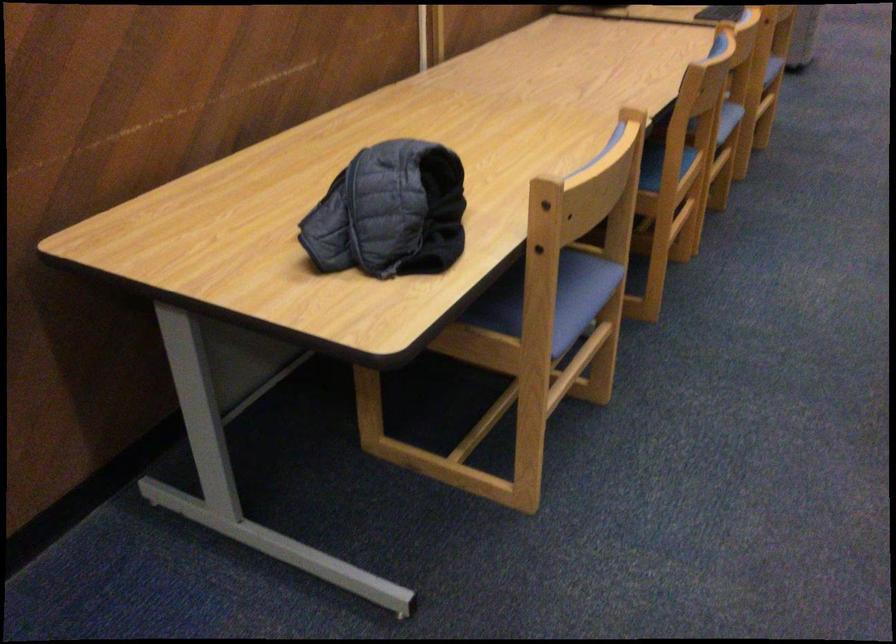
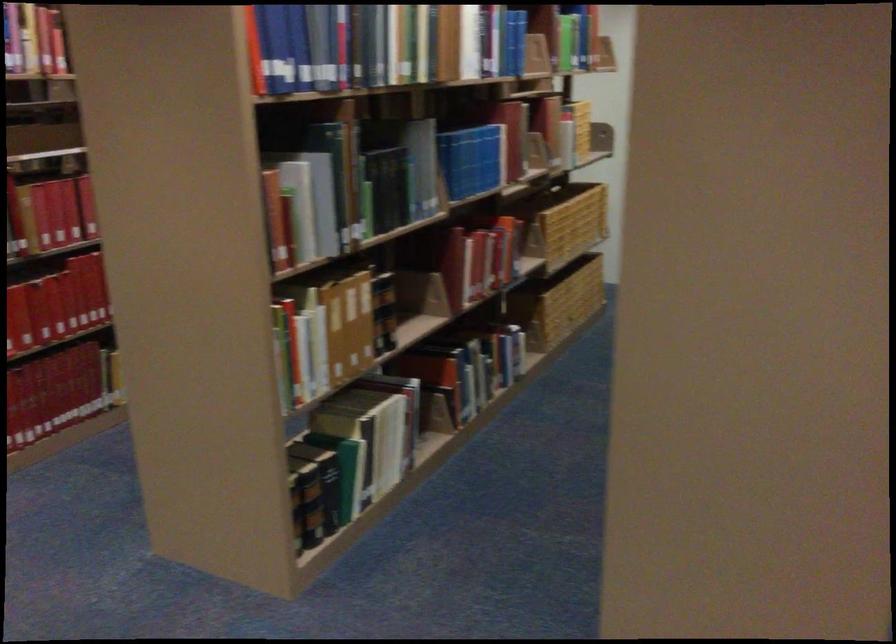
Based on the continuous images, in which direction is the camera rotating?

The rotation direction of the camera is right-down.